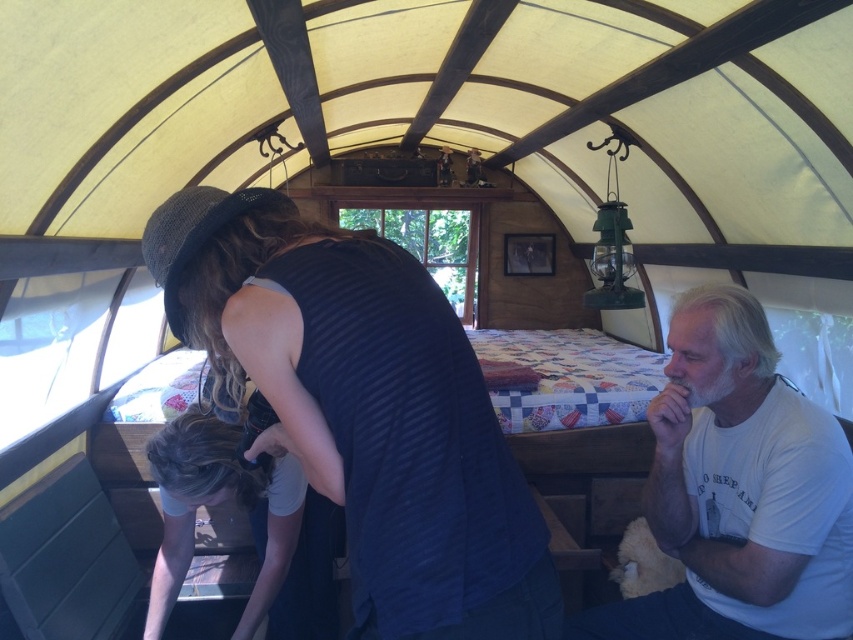
You are standing in the covered wagon and need to determine which item is shorter between the dark blue ribbed tank top at center and the dark blue fabric at center. Which one is shorter?

The dark blue ribbed tank top at center is shorter than the dark blue fabric at center.

You are a tailor measuring fabric for a costume. You have a dark blue ribbed tank top at center and a dark blue fabric at center. Which item requires more fabric in terms of width for the costume?

The dark blue ribbed tank top at center requires more fabric in terms of width since its width surpasses that of the dark blue fabric at center.